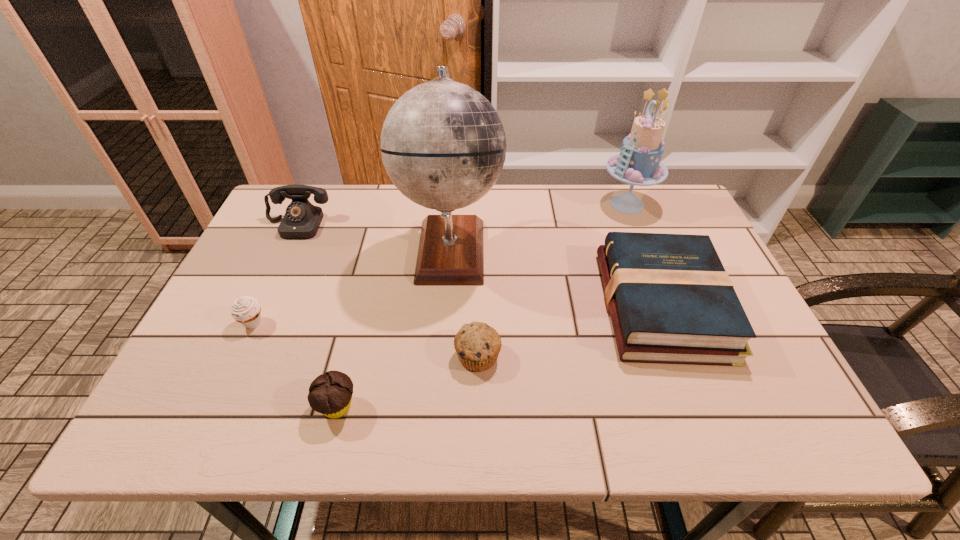
Locate an element on the screen. object at the near edge is located at coordinates (330, 394).

This screenshot has height=540, width=960. I want to click on telephone that is positioned at the left edge, so click(x=302, y=219).

Identify the location of muffin that is positioned at the left edge. (246, 310).

Locate an element on the screen. cake located in the right edge section of the desktop is located at coordinates (639, 163).

Locate an element on the screen. hardback book situated at the right edge is located at coordinates (671, 301).

Find the location of `object present at the far left corner`. object present at the far left corner is located at coordinates (302, 219).

Where is `object present at the far right corner`? This screenshot has height=540, width=960. object present at the far right corner is located at coordinates (639, 163).

The image size is (960, 540). I want to click on free space at the far edge of the desktop, so click(x=348, y=225).

This screenshot has width=960, height=540. I want to click on vacant space at the near edge of the desktop, so click(566, 434).

Find the location of a particular element. This screenshot has width=960, height=540. blank space at the left edge is located at coordinates (230, 301).